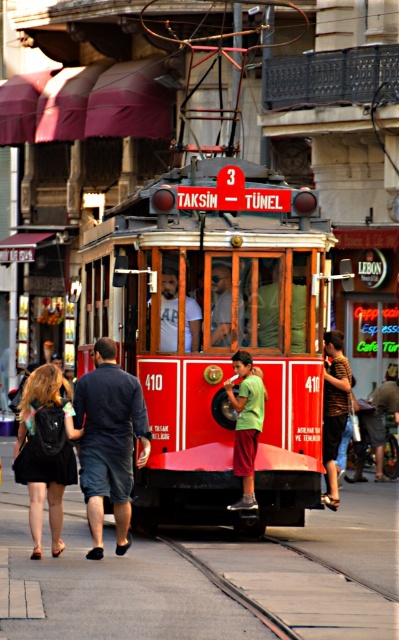
You are a photographer standing at the tram stop and want to take a photo of the striped shirt at center and the matte white shirt at center. If your camera can focus on objects within 8 feet, will both shirts be in focus?

The striped shirt at center is 7.92 feet away from matte white shirt at center. Since the distance between them is within the camera focus range of 8 feet, both shirts will be in focus.